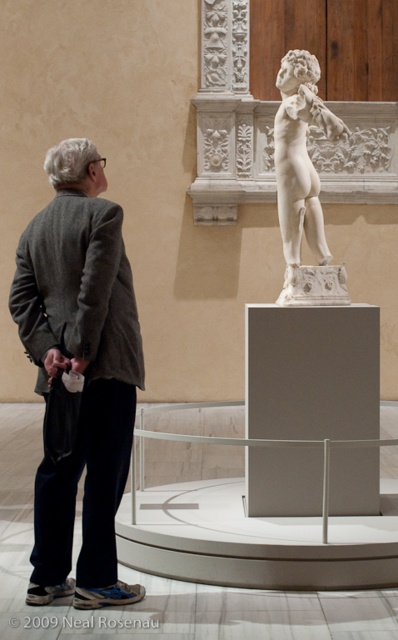
You are a museum security guard who needs to ensure that the gray wool jacket at left and the white marble statue at center are visible to visitors. Since the jacket is on a bench nearby, could the jacket possibly block the view of the statue?

The gray wool jacket at left is wider than the white marble statue at center. Therefore, if placed on a bench near the statue, the jacket might block the statue from view because its width is greater.

You are a security guard in the museum and notice the gray wool jacket at left and the white marble statue at center. Which object is positioned lower in the scene?

The gray wool jacket at left is located below the white marble statue at center, so it is positioned lower in the scene.